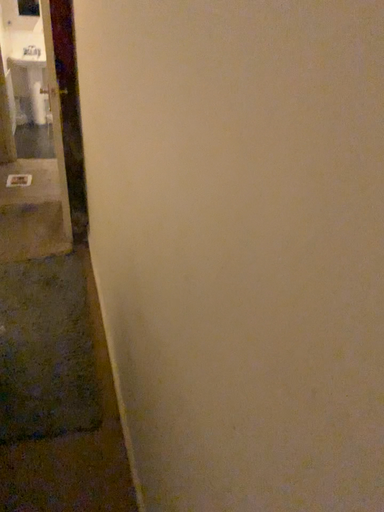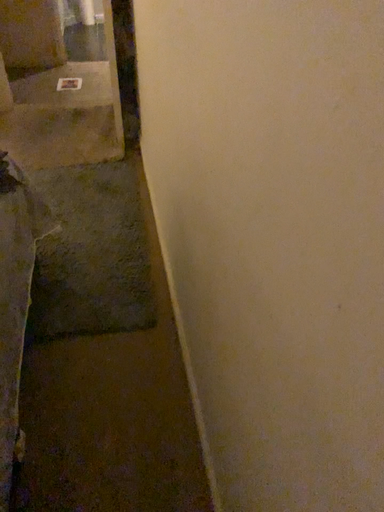
Question: How did the camera likely rotate when shooting the video?

Choices:
 (A) rotated right
 (B) rotated left

Answer: (B)